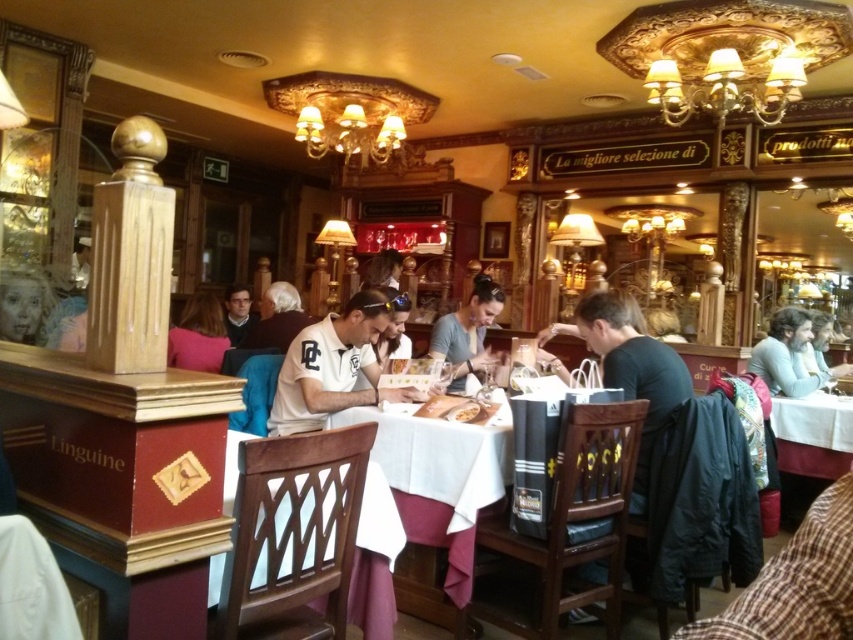
You are a guest at the restaurant and want to check the menu. There is a matte gray shirt at center and a pink fabric at center in your view. Which object is closer to you?

The matte gray shirt at center is closer to you because it is in front of the pink fabric at center.

You are a customer sitting at the restaurant table. You notice a pink fabric at center that you want to reach. If your arm can extend 12 feet, can you comfortably reach it?

The pink fabric at center is 12.01 feet away from viewer, so your arm cannot reach it since it is slightly further than your arm can extend.

You are a waiter in the restaurant and need to place a dessert plate on the table. The dessert plate is quite large and requires a clear space. Which object should you move first to make space between the plaid fabric at lower right and the matte black glasses at center?

The plaid fabric at lower right is to the right of the matte black glasses at center, so you should move the plaid fabric at lower right first to create space between them.